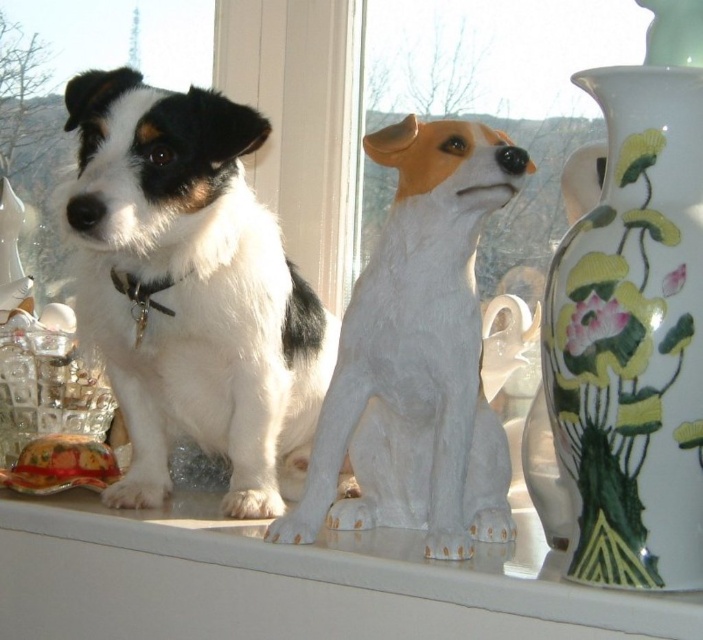
You are a delivery robot that needs to place a package on the white glossy window sill at center. The package is 6 inches long. Will the package fit on the space between the white glossy statue at center and the edge of the window sill?

The white glossy statue at center and white glossy window sill at center are 5.85 inches apart. Since the package is 6 inches long, it will not fit in the available space between the statue and the edge of the window sill.

You are an interior designer arranging a window sill. You have a black and white fur dog at center and a porcelain vase with floral design at right. Which object is placed closer to the edge of the window sill?

The black and white fur dog at center is positioned over porcelain vase with floral design at right, meaning it is closer to the edge of the window sill.

You are a delivery person who needs to place a small package on the tallest object in the scene. Which object should you choose between the black and white fur dog at center and the porcelain vase with floral design at right?

The black and white fur dog at center is much taller than the porcelain vase with floral design at right, so you should place the package on the black and white fur dog at center.